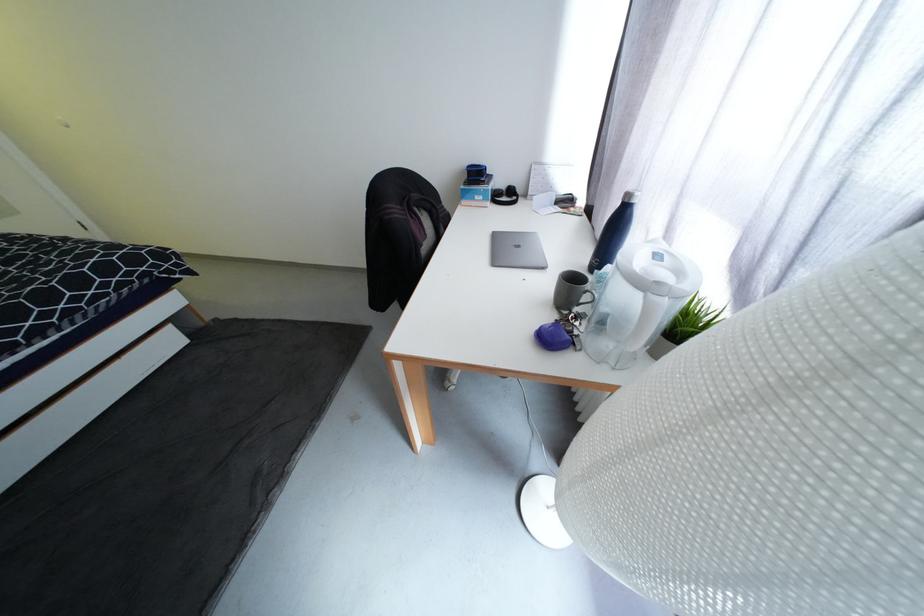
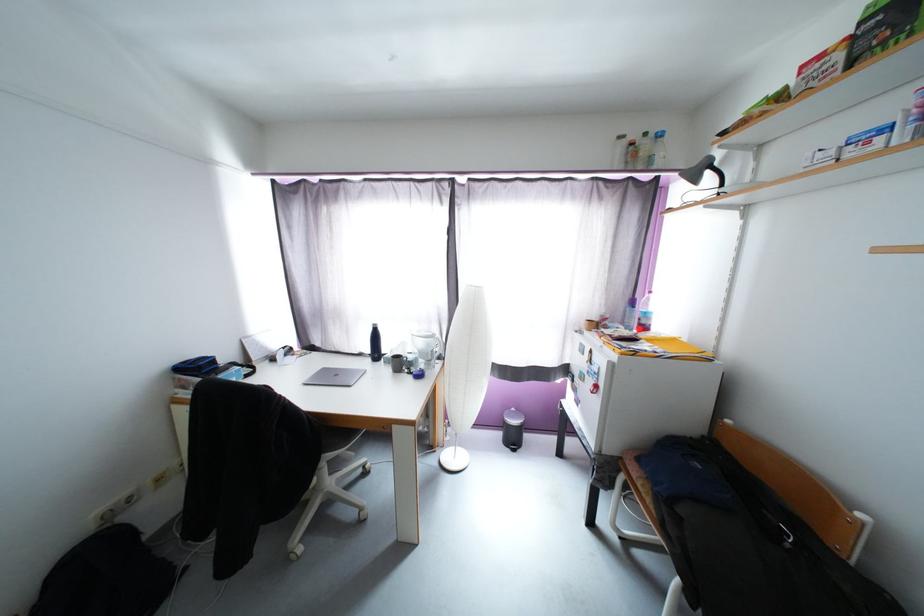
Locate, in the second image, the point that corresponds to point 539,471 in the first image.

(442, 464)